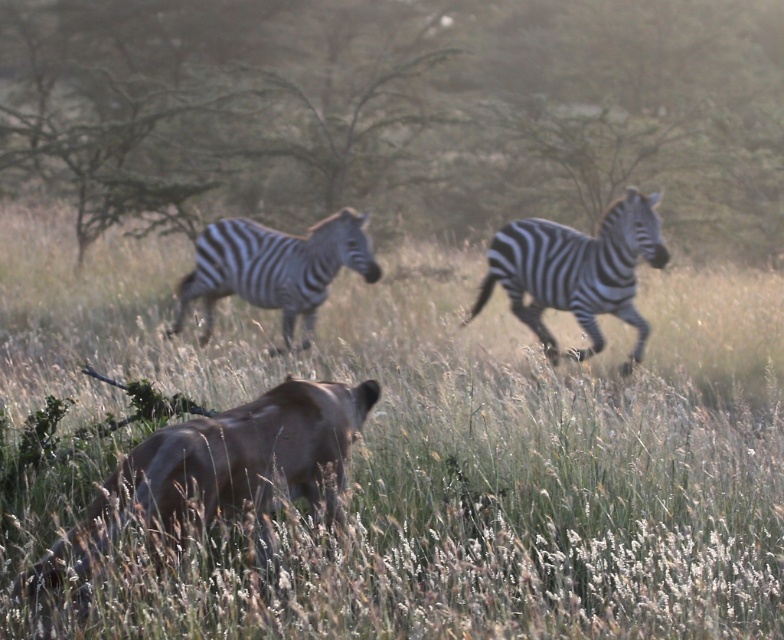
Question: From the image, what is the correct spatial relationship of green grassy at center in relation to brown fur antelope at lower left?

Choices:
 (A) left
 (B) right

Answer: (B)

Question: Observing the image, what is the correct spatial positioning of brown fur antelope at lower left in reference to black and white striped zebra at right?

Choices:
 (A) right
 (B) left

Answer: (B)

Question: Which point is farther to the camera?

Choices:
 (A) brown fur antelope at lower left
 (B) green leafy tree at upper center
 (C) black and white striped zebra at right
 (D) black and white striped zebra at center

Answer: (B)

Question: Does green grassy at center have a smaller size compared to black and white striped zebra at center?

Choices:
 (A) yes
 (B) no

Answer: (B)

Question: Which point appears closest to the camera in this image?

Choices:
 (A) (194, 483)
 (B) (256, 221)

Answer: (A)

Question: Which of the following is the farthest from the observer?

Choices:
 (A) green leafy tree at upper center
 (B) black and white striped zebra at center
 (C) green grassy at center

Answer: (A)